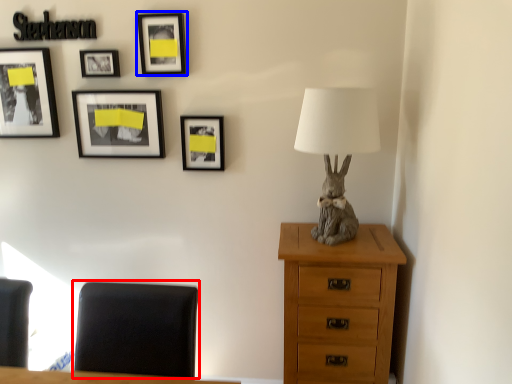
Question: Which point is further to the camera, furniture (highlighted by a red box) or picture frame (highlighted by a blue box)?

Choices:
 (A) furniture
 (B) picture frame

Answer: (B)